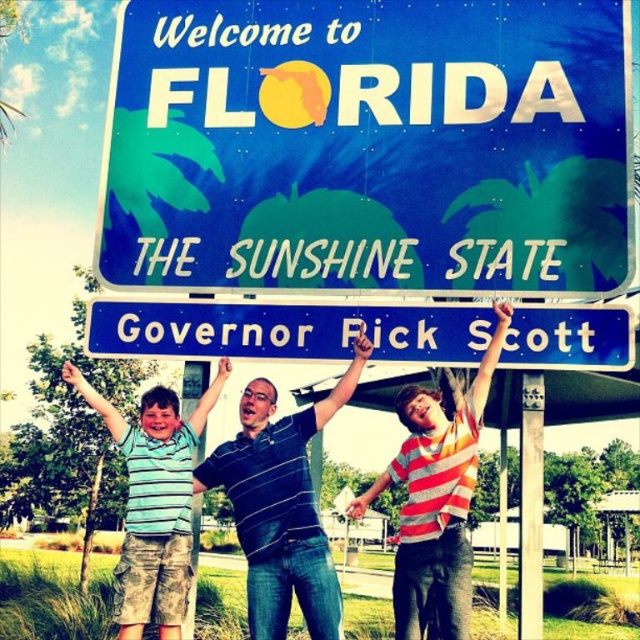
Image resolution: width=640 pixels, height=640 pixels. In order to click on blue glossy sign at upper center in this screenshot , I will do tap(369, 145).

Based on the photo, between blue glossy sign at upper center and green striped shirt at center, which one has less height?

With less height is blue glossy sign at upper center.

Is point (524, 166) positioned in front of point (124, 609)?

Yes, it is in front of point (124, 609).

You are a GUI agent. You are given a task and a screenshot of the screen. Output one action in this format:
    pyautogui.click(x=<x>, y=<y>)
    Task: Click on the blue glossy sign at upper center
    This screenshot has width=640, height=640.
    Given the screenshot: What is the action you would take?
    pyautogui.click(x=369, y=145)

Which is more to the left, striped polo shirt at center or green striped shirt at center?

From the viewer's perspective, green striped shirt at center appears more on the left side.

Does striped polo shirt at center have a smaller size compared to green striped shirt at center?

Yes, striped polo shirt at center is smaller than green striped shirt at center.

Is point (243, 492) in front of point (112, 429)?

Yes.

I want to click on striped polo shirt at center, so (280, 506).

How distant is blue metallic street sign at center from metallic pole at center?

24.36 feet

Identify the location of blue metallic street sign at center. The image size is (640, 640). (288, 330).

Measure the distance between blue metallic street sign at center and camera.

blue metallic street sign at center is 28.80 meters away from camera.

This screenshot has width=640, height=640. I want to click on blue metallic street sign at center, so [288, 330].